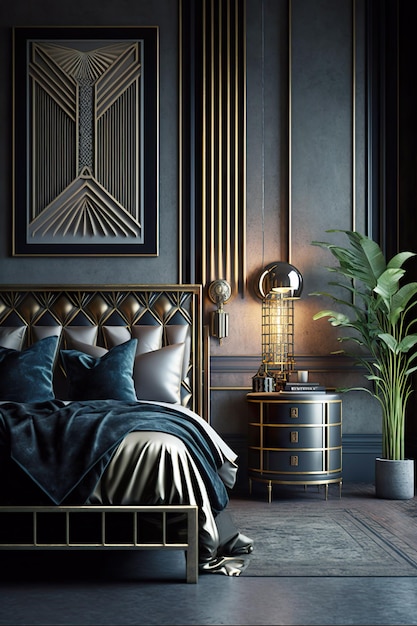
Locate an element on the screen. The height and width of the screenshot is (626, 417). headboard is located at coordinates (143, 303), (195, 371), (185, 380).